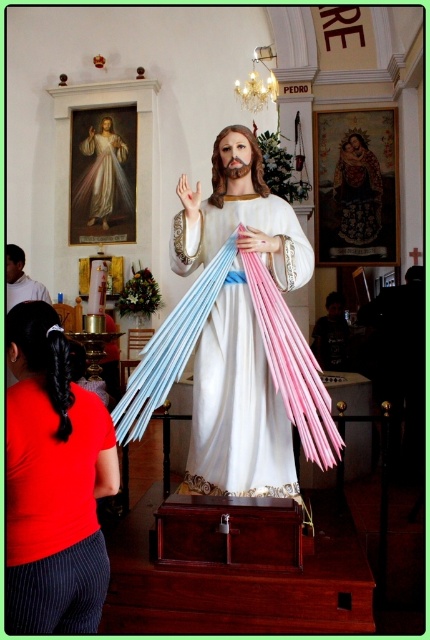
You are an interior designer planning to add a new decoration to the church. You have a small golden frame that is 20 cm in height. You want to place it near the matte red shirt at center and the embroidered fabric portrait at upper center. Which object should you place it next to if you want the frame to look proportionally smaller?

The small golden frame should be placed next to the embroidered fabric portrait at upper center because the matte red shirt at center is bigger than the embroidered fabric portrait at upper center, so the frame will look proportionally smaller next to the smaller object.